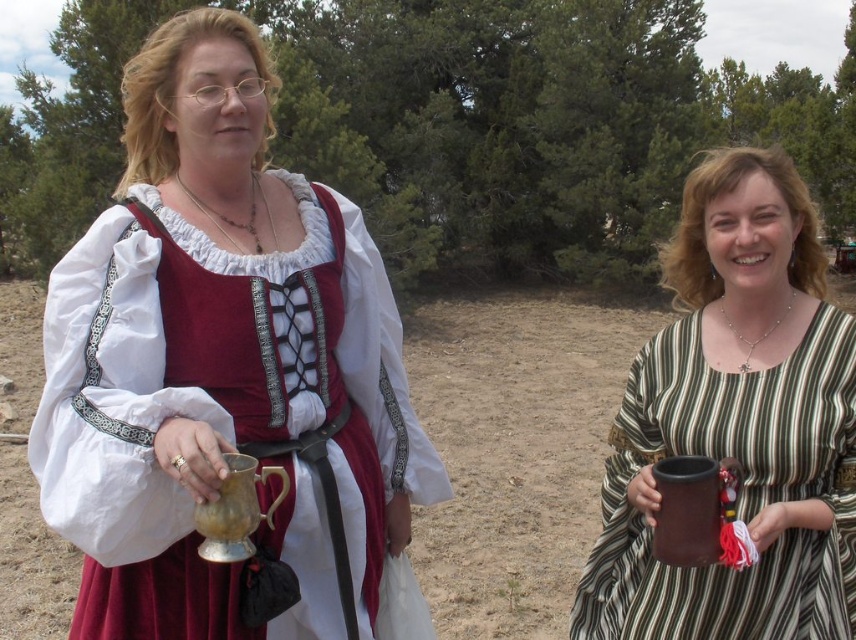
Question: Does metallic gold cup at center have a smaller size compared to brown sandy dirt at center?

Choices:
 (A) yes
 (B) no

Answer: (A)

Question: Which object appears farthest from the camera in this image?

Choices:
 (A) brown sandy dirt at center
 (B) brown matte mug at upper right
 (C) metallic gold cup at center

Answer: (A)

Question: Does metallic gold cup at center have a lesser width compared to brown matte mug at upper right?

Choices:
 (A) no
 (B) yes

Answer: (A)

Question: Which of the following is the closest to the observer?

Choices:
 (A) (723, 291)
 (B) (336, 321)
 (C) (450, 346)

Answer: (B)

Question: Where is metallic gold cup at center located in relation to brown sandy dirt at center in the image?

Choices:
 (A) left
 (B) right

Answer: (A)

Question: Which object appears farthest from the camera in this image?

Choices:
 (A) brown sandy dirt at center
 (B) brown matte mug at upper right

Answer: (A)